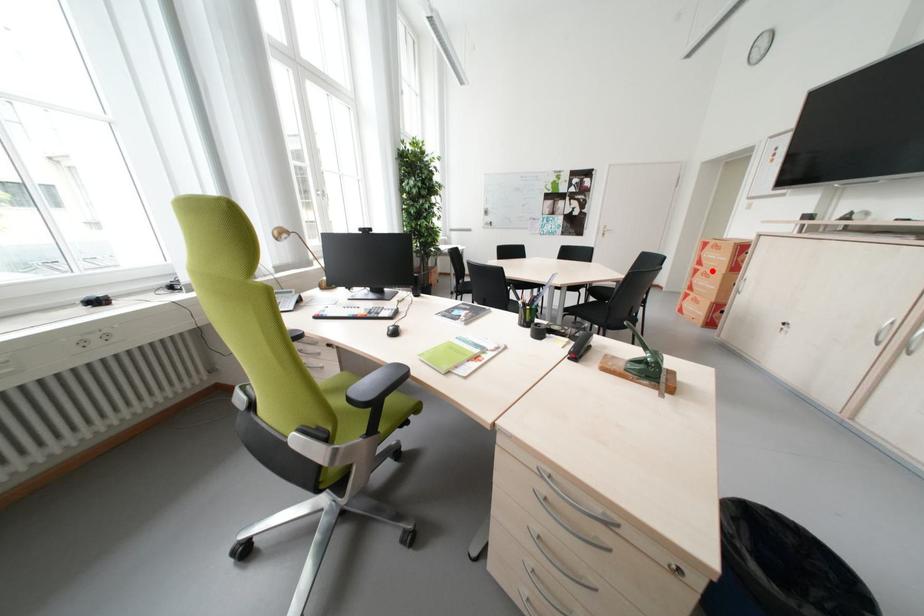
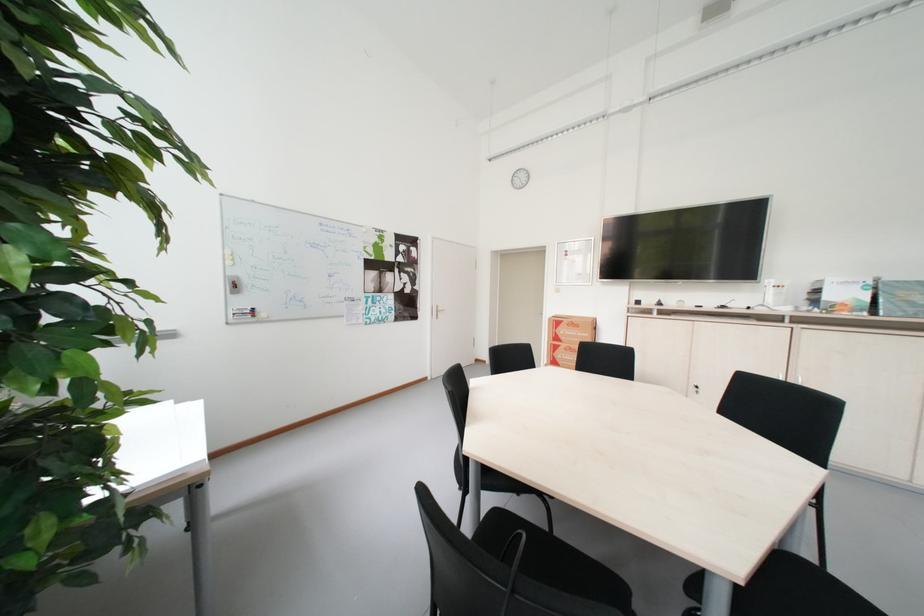
The point at the highlighted location is marked in the first image. Where is the corresponding point in the second image?

(573, 347)